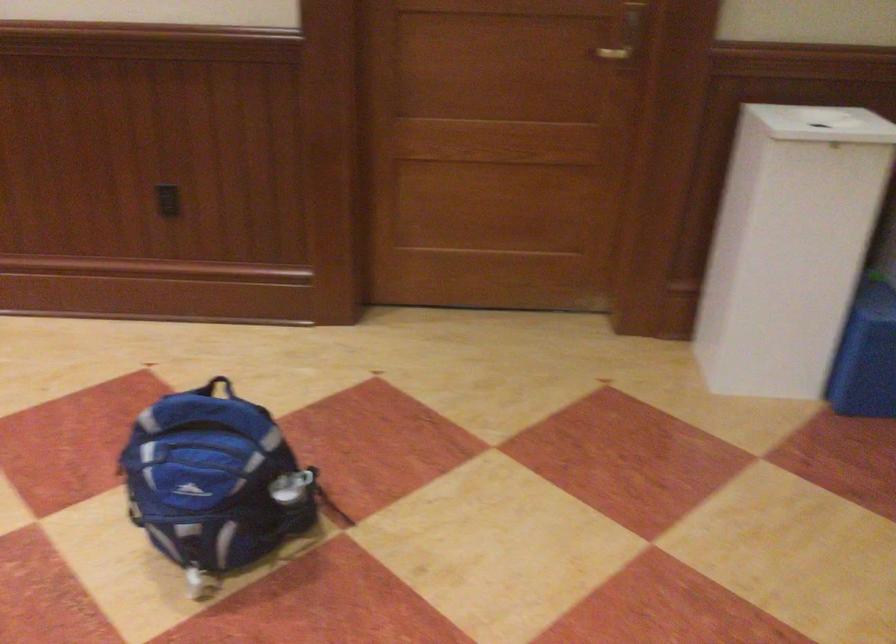
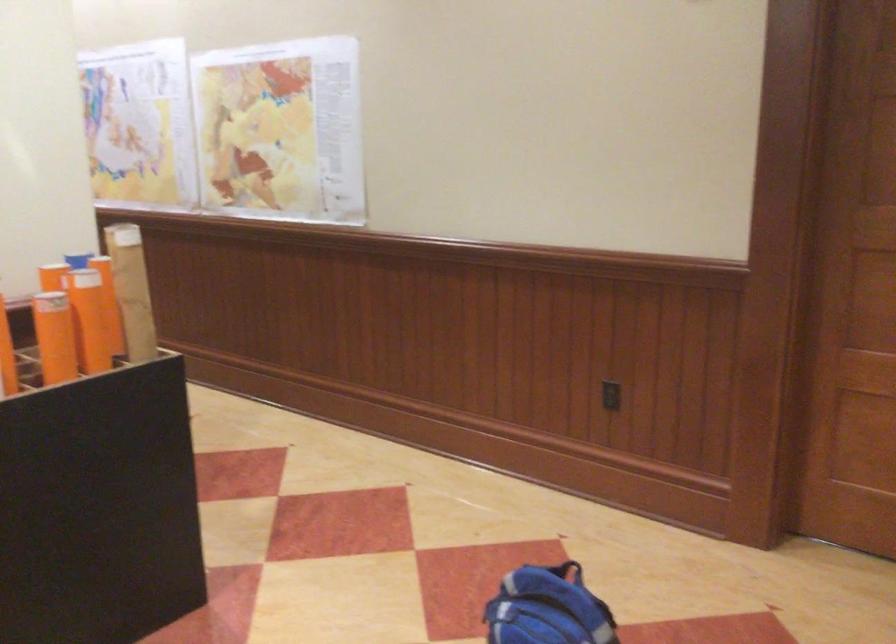
Locate, in the second image, the point that corresponds to point 220,381 in the first image.

(567, 571)